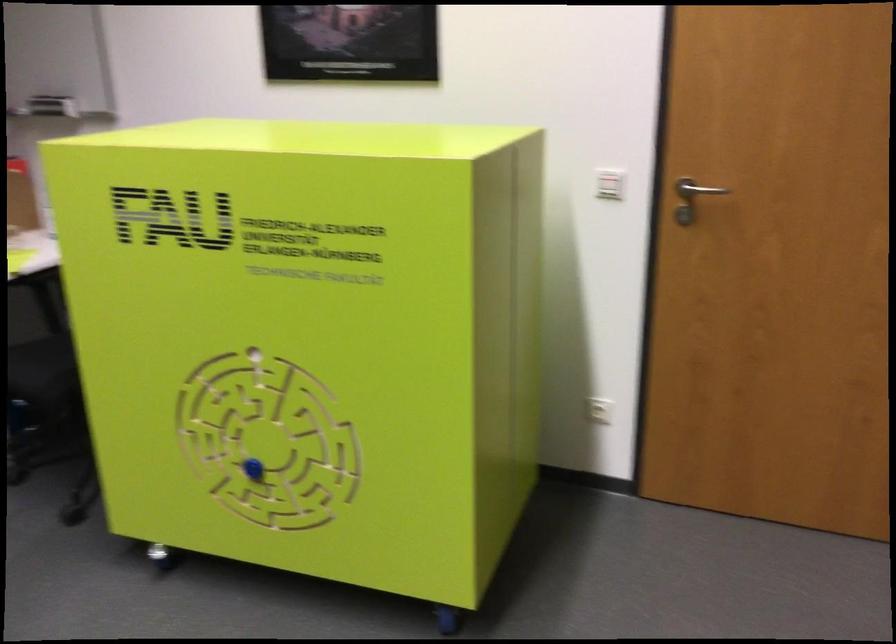
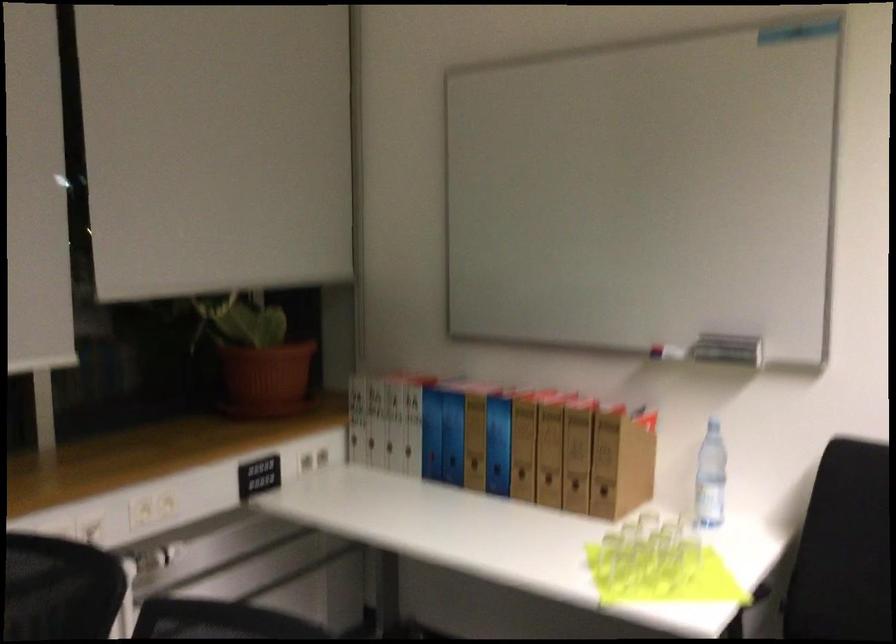
In a continuous first-person perspective shot, in which direction is the camera moving?

The cameraman moved toward left, forward.